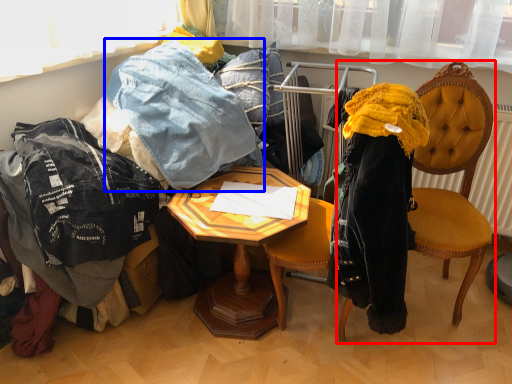
Question: Among these objects, which one is nearest to the camera, chair (highlighted by a red box) or trousers (highlighted by a blue box)?

Choices:
 (A) chair
 (B) trousers

Answer: (A)